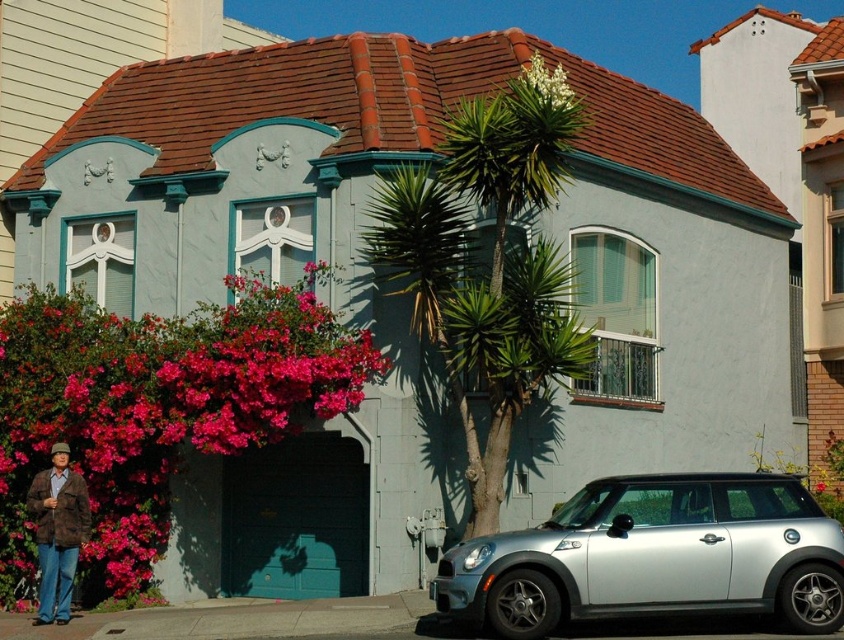
Question: From the image, what is the correct spatial relationship of pink matte flowers at lower left in relation to white textured plant at upper center?

Choices:
 (A) left
 (B) right

Answer: (A)

Question: Which object is positioned farthest from the silver metallic car at lower right?

Choices:
 (A) white textured plant at upper center
 (B) pink matte flowers at lower left
 (C) brown textured jacket at lower left

Answer: (B)

Question: Which object appears closest to the camera in this image?

Choices:
 (A) pink matte flowers at lower left
 (B) silver metallic car at lower right

Answer: (B)

Question: Is pink matte flowers at lower left to the left of silver metallic car at lower right from the viewer's perspective?

Choices:
 (A) no
 (B) yes

Answer: (B)

Question: Can you confirm if pink matte flowers at lower left is bigger than white textured plant at upper center?

Choices:
 (A) no
 (B) yes

Answer: (A)

Question: Which point appears closest to the camera in this image?

Choices:
 (A) (57, 566)
 (B) (339, 332)
 (C) (565, 99)
 (D) (718, 573)

Answer: (D)